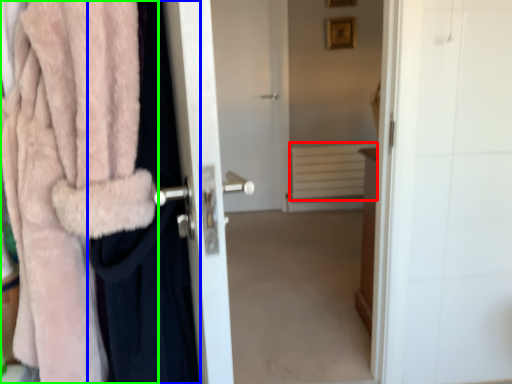
Question: Which is nearer to the radiator (highlighted by a red box)? clothing (highlighted by a blue box) or towel (highlighted by a green box).

Choices:
 (A) clothing
 (B) towel

Answer: (A)